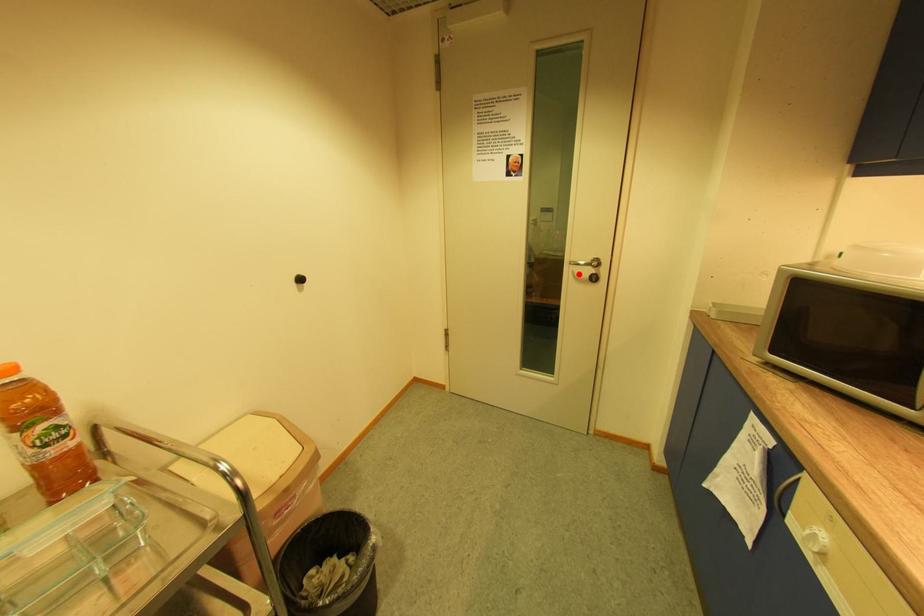
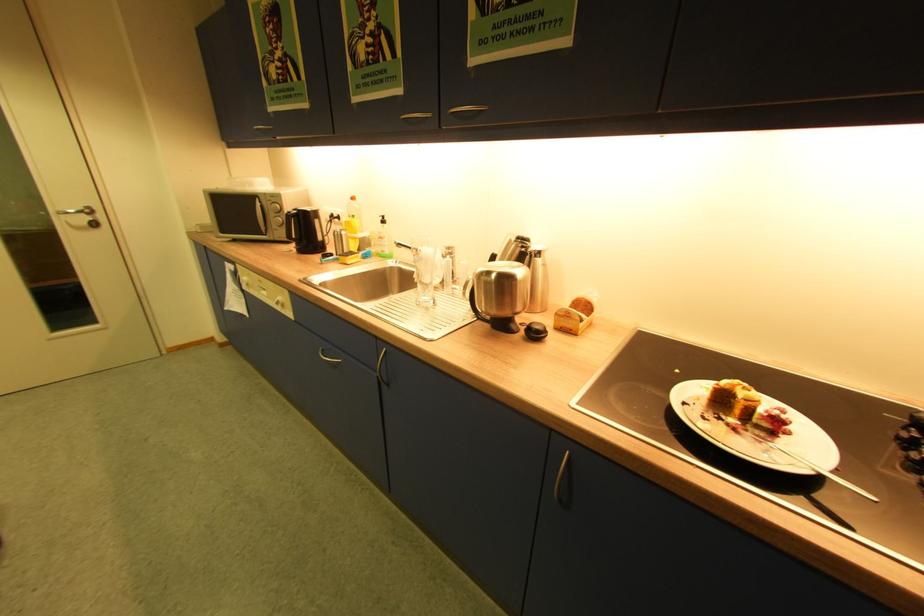
The point at the highlighted location is marked in the first image. Where is the corresponding point in the second image?

(74, 224)